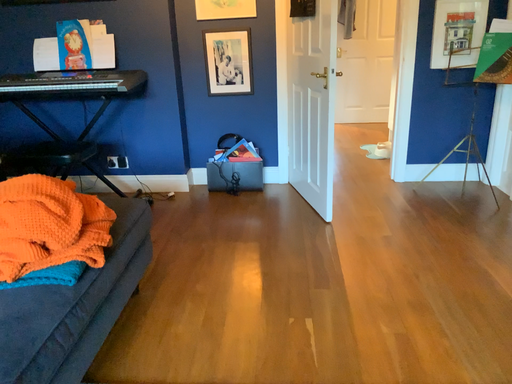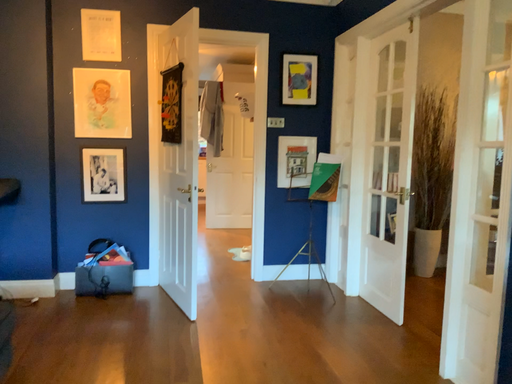
Question: How did the camera likely rotate when shooting the video?

Choices:
 (A) rotated left
 (B) rotated right

Answer: (B)